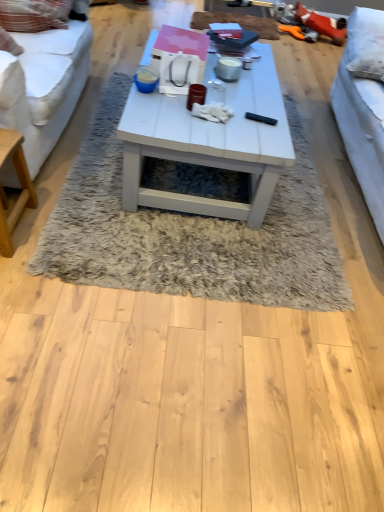
The image size is (384, 512). Identify the location of free space in front of white matte coffee table at center. point(186,248).